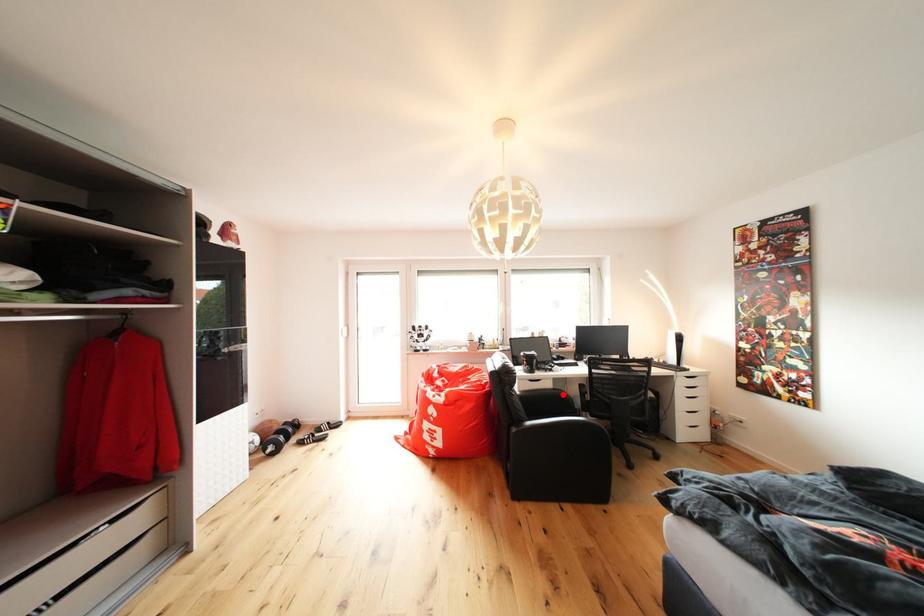
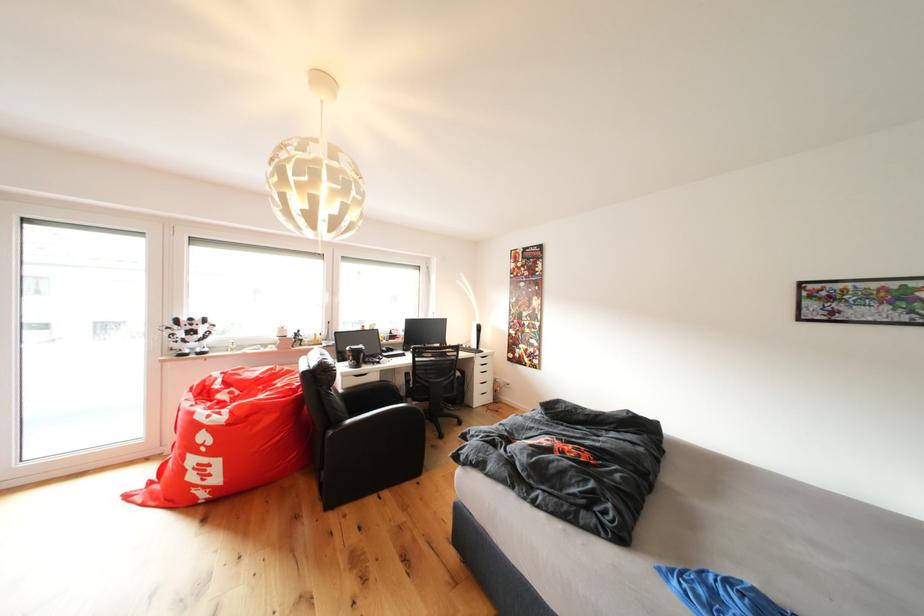
Question: I am providing you with two images of the same scene from different viewpoints. In image1, a red point is highlighted. Considering the same 3D point in image2, which of the following is correct?

Choices:
 (A) It is closer
 (B) It is farther

Answer: (A)